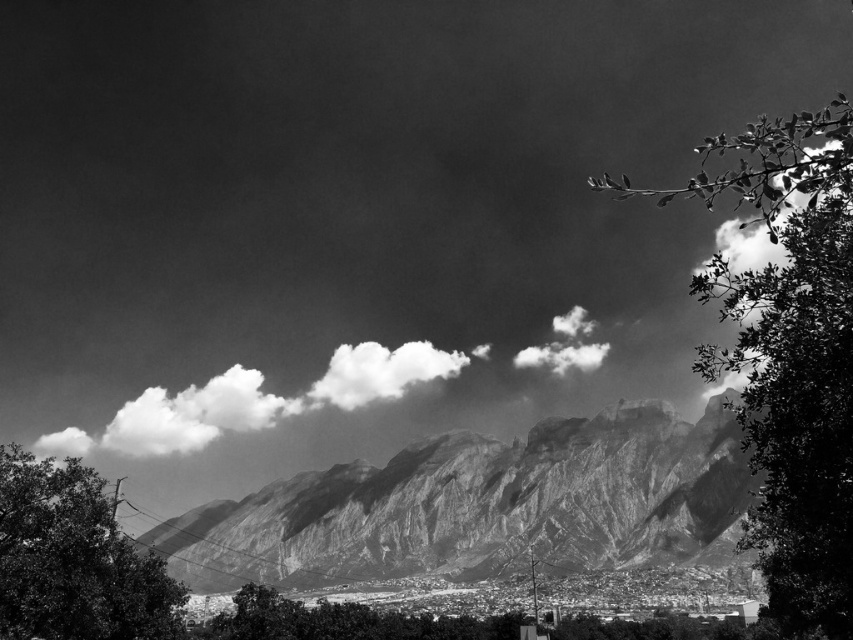
Question: Among these objects, which one is nearest to the camera?

Choices:
 (A) rugged stone mountain range at center
 (B) green leafy tree at lower left

Answer: (B)

Question: Which point appears farthest from the camera in this image?

Choices:
 (A) (4, 586)
 (B) (196, 416)

Answer: (B)

Question: Estimate the real-world distances between objects in this image. Which object is farther from the green leafy branch at upper right?

Choices:
 (A) cloudy sky at center
 (B) green leafy tree at lower left
 (C) white fluffy cloud at center
 (D) rugged stone mountain range at center

Answer: (A)

Question: Is green leafy tree at lower left positioned at the back of white fluffy cloud at center?

Choices:
 (A) no
 (B) yes

Answer: (A)

Question: Can you confirm if rugged stone mountain range at center is bigger than cloudy sky at center?

Choices:
 (A) no
 (B) yes

Answer: (B)

Question: Is the position of green leafy tree at lower left more distant than that of white fluffy cloud at center?

Choices:
 (A) yes
 (B) no

Answer: (B)